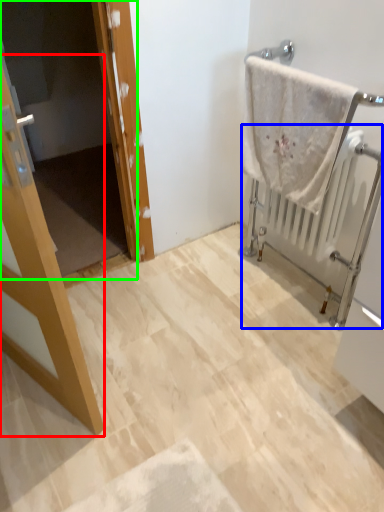
Question: Which is farther away from door (highlighted by a red box)? radiator (highlighted by a blue box) or screen door (highlighted by a green box)?

Choices:
 (A) radiator
 (B) screen door

Answer: (B)